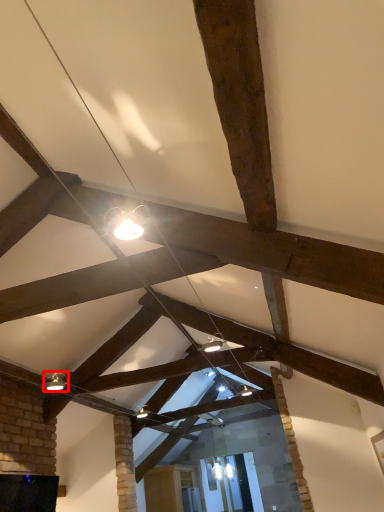
Question: From the image's perspective, where is light fixture (annotated by the red box) located relative to furniture?

Choices:
 (A) above
 (B) below

Answer: (A)